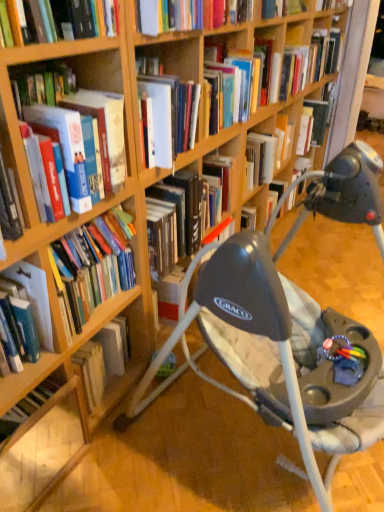
Question: Is hardcover book at left, which is counted as the first book, starting from the front, looking in the opposite direction of hardcover book at lower left, which is counted as the fifth book, starting from the top?

Choices:
 (A) no
 (B) yes

Answer: (A)

Question: Is hardcover book at left, the 3th book ordered from the bottom, facing towards hardcover book at lower left, placed as the second book when sorted from front to back?

Choices:
 (A) yes
 (B) no

Answer: (B)

Question: Can you confirm if hardcover book at left, which is counted as the first book, starting from the front, is taller than hardcover book at lower left, which is counted as the first book, starting from the bottom?

Choices:
 (A) no
 (B) yes

Answer: (A)

Question: Is hardcover book at left, which appears as the 3th book when viewed from the top, to the right of hardcover book at lower left, which is the 5th book in right-to-left order, from the viewer's perspective?

Choices:
 (A) no
 (B) yes

Answer: (B)

Question: From a real-world perspective, does hardcover book at left, which appears as the 3th book when viewed from the top, stand above hardcover book at lower left, which is counted as the fifth book, starting from the top?

Choices:
 (A) no
 (B) yes

Answer: (B)

Question: Visually, is hardcover book at upper right, the 2th book viewed from the right, positioned to the left or to the right of hardcover book at lower left, which is counted as the fifth book, starting from the top?

Choices:
 (A) right
 (B) left

Answer: (A)

Question: From a real-world perspective, is hardcover book at upper right, the 2th book viewed from the right, physically located above or below hardcover book at lower left, which is counted as the fifth book, starting from the top?

Choices:
 (A) above
 (B) below

Answer: (B)

Question: Is hardcover book at upper right, the fourth book from the left, wider or thinner than hardcover book at lower left, placed as the second book when sorted from front to back?

Choices:
 (A) wide
 (B) thin

Answer: (B)

Question: Is hardcover book at upper right, acting as the second book starting from the back, inside the boundaries of hardcover book at lower left, placed as the second book when sorted from front to back, or outside?

Choices:
 (A) inside
 (B) outside

Answer: (B)

Question: Is hardcover book at upper right, the first book in the right-to-left sequence, inside or outside of hardcover book at upper right, which is the fourth book in bottom-to-top order?

Choices:
 (A) inside
 (B) outside

Answer: (B)

Question: Is point (319, 77) closer or farther from the camera than point (317, 124)?

Choices:
 (A) closer
 (B) farther

Answer: (A)

Question: Considering the relative positions of hardcover book at upper right, marked as the 1th book in a back-to-front arrangement, and hardcover book at upper right, arranged as the second book when viewed from the top, in the image provided, is hardcover book at upper right, marked as the 1th book in a back-to-front arrangement, to the left or to the right of hardcover book at upper right, arranged as the second book when viewed from the top,?

Choices:
 (A) left
 (B) right

Answer: (B)

Question: From their relative heights in the image, would you say hardcover book at upper right, placed as the first book when sorted from top to bottom, is taller or shorter than hardcover book at upper right, arranged as the fourth book when viewed from the front?

Choices:
 (A) short
 (B) tall

Answer: (B)

Question: Is hardcover book at upper right, the first book in the right-to-left sequence, to the left or to the right of hardcover book at left, which is the 2th book from bottom to top, in the image?

Choices:
 (A) left
 (B) right

Answer: (B)

Question: Does point (332, 59) appear closer or farther from the camera than point (74, 321)?

Choices:
 (A) closer
 (B) farther

Answer: (B)